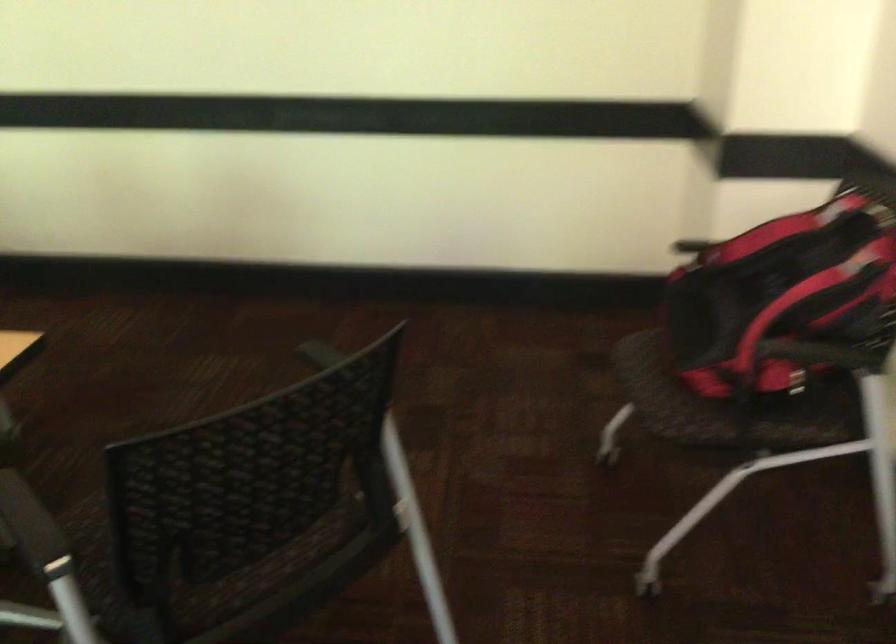
Identify the location of red and black backpack. The height and width of the screenshot is (644, 896). (785, 283).